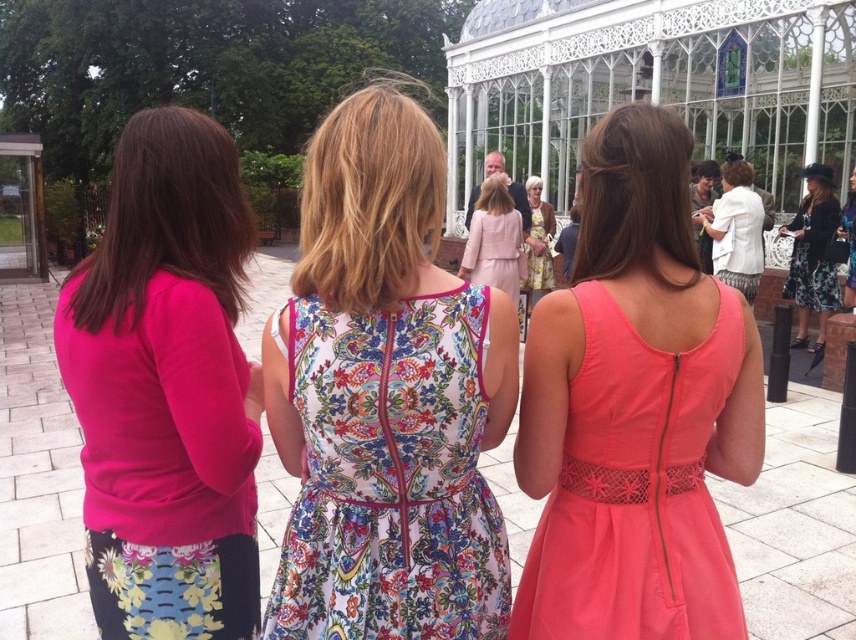
You are a photographer at a wedding reception and want to capture a candid shot of the three women. You notice a matte pink sweater at left located at point [165,388]. If you position your camera at point 0.5, 0.5, will the matte pink sweater at left be visible in your shot?

The matte pink sweater at left is located at point [165,388]. Since the camera is positioned at 0.5, 0.5, the sweater is to the right and slightly below the camera, so it would be visible in the shot.

You are standing at the position of the point at coordinates point (183,460) and want to walk towards the point at coordinates point (726,246). Given that the two points are part of the scene described, which direction should you move relative to the image?

You should move backward because point (183,460) is in front of point (726,246), so moving toward it would require going in the opposite direction.